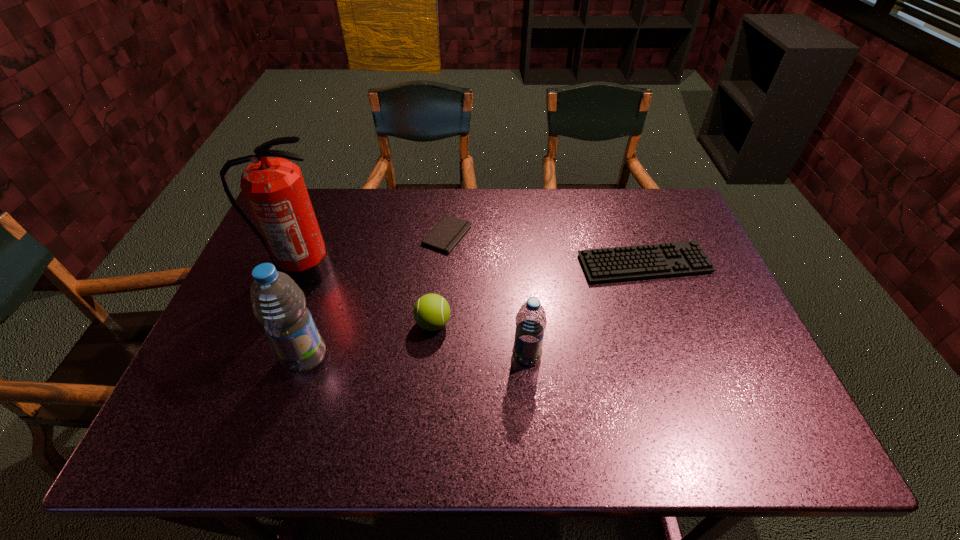
The width and height of the screenshot is (960, 540). In order to click on free point between the fifth tallest object and the tennis ball in this screenshot , I will do `click(539, 294)`.

Find the location of a particular element. This screenshot has height=540, width=960. free space between the second object from right to left and the left water bottle is located at coordinates (416, 356).

Locate an element on the screen. Image resolution: width=960 pixels, height=540 pixels. object that is the nearest to the fifth shortest object is located at coordinates (274, 188).

What are the coordinates of `the third closest object to the fire extinguisher` in the screenshot? It's located at (431, 312).

This screenshot has height=540, width=960. What are the coordinates of `vacant space that satisfies the following two spatial constraints: 1. on the back side of the left water bottle; 2. on the left side of the fifth object from left to right` in the screenshot? It's located at (306, 355).

Where is `blank space that satisfies the following two spatial constraints: 1. on the front side of the shortest object; 2. on the right side of the shorter water bottle`? The width and height of the screenshot is (960, 540). blank space that satisfies the following two spatial constraints: 1. on the front side of the shortest object; 2. on the right side of the shorter water bottle is located at coordinates (438, 355).

The height and width of the screenshot is (540, 960). What are the coordinates of `vacant area that satisfies the following two spatial constraints: 1. on the front side of the tallest object; 2. on the left side of the tennis ball` in the screenshot? It's located at (280, 323).

Image resolution: width=960 pixels, height=540 pixels. In order to click on free spot that satisfies the following two spatial constraints: 1. on the front side of the shortest object; 2. on the right side of the second shortest object in this screenshot , I will do `click(444, 264)`.